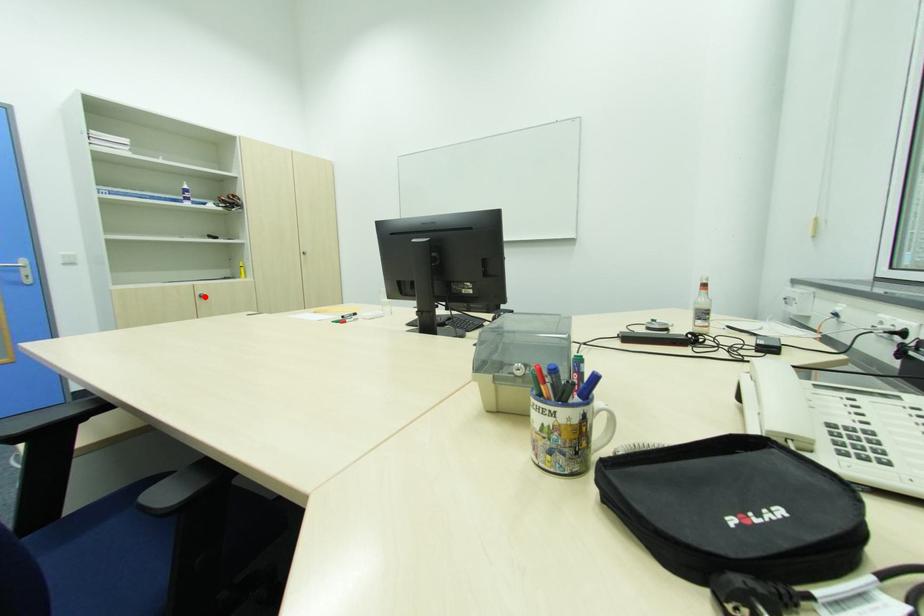
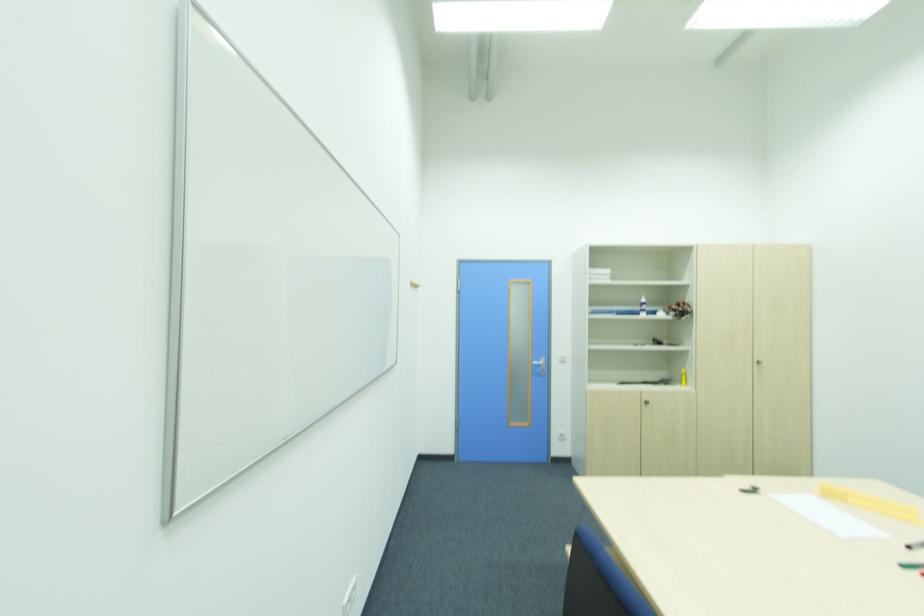
Question: I am providing you with two images of the same scene from different viewpoints. Image1 has a red point marked. In image2, the corresponding 3D location appears at what relative position? Reply with the corresponding letter.

Choices:
 (A) Closer
 (B) Farther

Answer: (B)